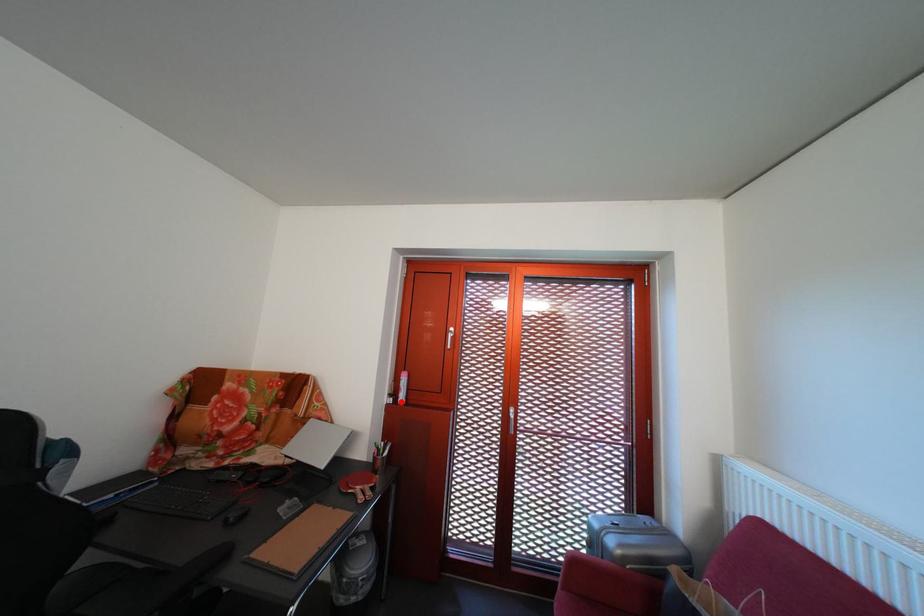
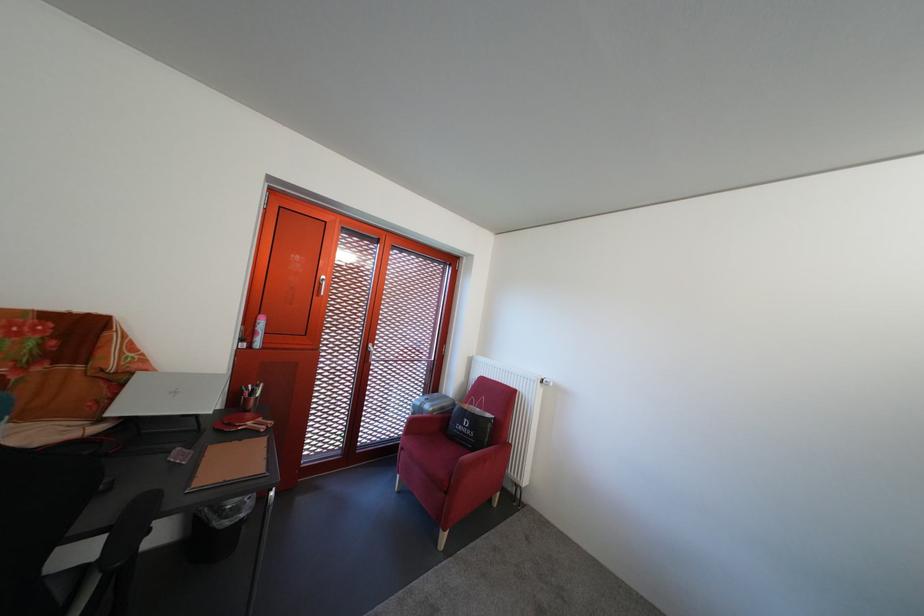
Locate, in the second image, the point that corresponds to the highlighted location in the first image.

(252, 346)